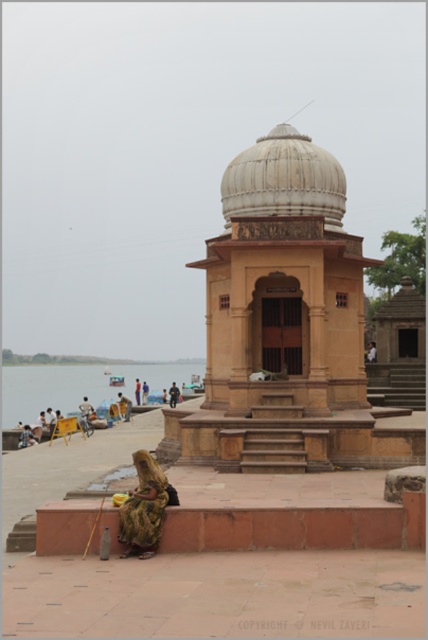
You are standing at the riverside temple and notice the blue water at lower left and the gold textured saree at lower left. Which object is wider from your perspective?

The blue water at lower left is wider than the gold textured saree at lower left according to the description.

You are standing at the riverbank and want to take a photo of both point (168,369) and point (166,492) in the scene. Which point should you focus on first if you want to ensure both are in focus?

You should focus on point (168,369) first because it is closer to the camera than point (166,492), ensuring both are within the depth of field.

You are standing at the riverside temple and want to take a photo of the blue water at lower left and the gold textured saree at lower left. Which object should you frame first in your camera viewfinder to ensure both are in the shot?

The blue water at lower left is to the left of the gold textured saree at lower left, so you should frame the blue water at lower left first to include both in the shot.